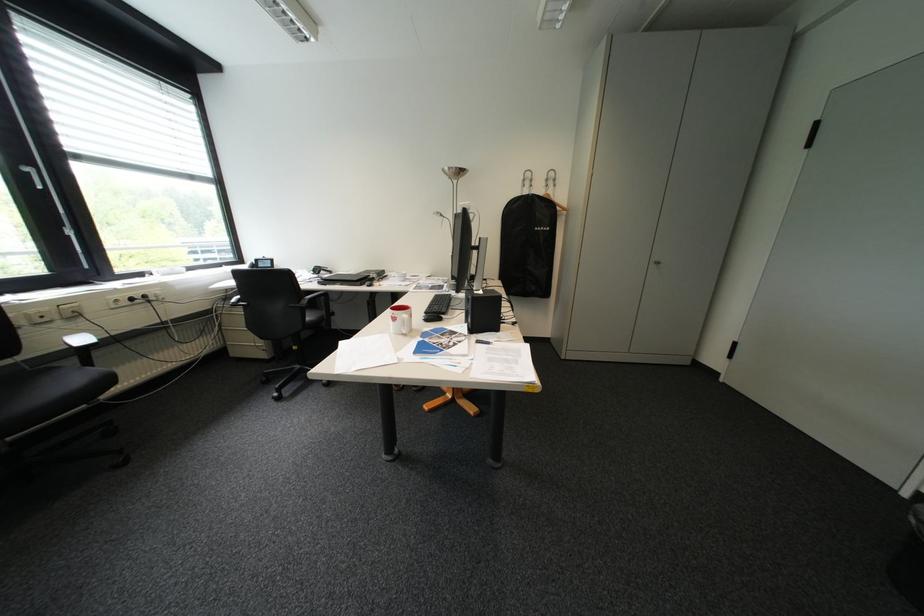
What do you see at coordinates (46, 337) in the screenshot?
I see `the black chair armrest` at bounding box center [46, 337].